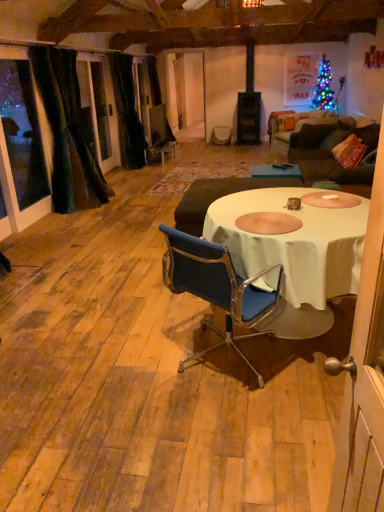
Question: From a real-world perspective, is white cloth table at center under velvet dark brown armchair at center?

Choices:
 (A) yes
 (B) no

Answer: (B)

Question: From a real-world perspective, is white cloth table at center on velvet dark brown armchair at center?

Choices:
 (A) yes
 (B) no

Answer: (A)

Question: Is white cloth table at center facing towards velvet dark brown armchair at center?

Choices:
 (A) no
 (B) yes

Answer: (A)

Question: Is white cloth table at center smaller than velvet dark brown armchair at center?

Choices:
 (A) no
 (B) yes

Answer: (A)

Question: Is white cloth table at center next to velvet dark brown armchair at center?

Choices:
 (A) yes
 (B) no

Answer: (B)

Question: Is black velvet curtain at left, which is counted as the first curtain, starting from the back, in front of or behind velvet dark green curtain at left, acting as the second curtain starting from the back, in the image?

Choices:
 (A) behind
 (B) front

Answer: (A)

Question: From the image's perspective, is black velvet curtain at left, the 2th curtain viewed from the front, above or below velvet dark green curtain at left, the 1th curtain from the front?

Choices:
 (A) below
 (B) above

Answer: (B)

Question: Looking at their shapes, would you say black velvet curtain at left, which is counted as the first curtain, starting from the back, is wider or thinner than velvet dark green curtain at left, acting as the second curtain starting from the back?

Choices:
 (A) wide
 (B) thin

Answer: (B)

Question: In terms of height, does black velvet curtain at left, which is counted as the first curtain, starting from the back, look taller or shorter compared to velvet dark green curtain at left, the 1th curtain from the front?

Choices:
 (A) tall
 (B) short

Answer: (A)

Question: From their relative heights in the image, would you say white fabric table at center is taller or shorter than black velvet curtain at left, the 2th curtain viewed from the front?

Choices:
 (A) short
 (B) tall

Answer: (A)

Question: Is point (261, 168) closer or farther from the camera than point (112, 84)?

Choices:
 (A) farther
 (B) closer

Answer: (B)

Question: Which is correct: white fabric table at center is inside black velvet curtain at left, the 2th curtain viewed from the front, or outside of it?

Choices:
 (A) outside
 (B) inside

Answer: (A)

Question: From a real-world perspective, is white fabric table at center above or below black velvet curtain at left, which is counted as the first curtain, starting from the back?

Choices:
 (A) below
 (B) above

Answer: (A)

Question: Is point (x=167, y=232) positioned closer to the camera than point (x=72, y=186)?

Choices:
 (A) closer
 (B) farther

Answer: (A)

Question: Is blue fabric chair at center bigger or smaller than velvet dark green curtain at left, the 1th curtain from the front?

Choices:
 (A) big
 (B) small

Answer: (B)